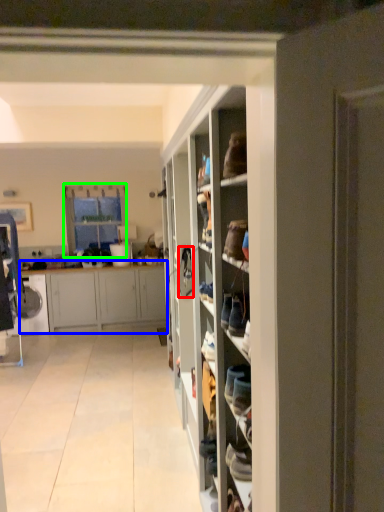
Question: Which object is positioned farthest from shoe (highlighted by a red box)? Select from cabinetry (highlighted by a blue box) and window (highlighted by a green box).

Choices:
 (A) cabinetry
 (B) window

Answer: (B)